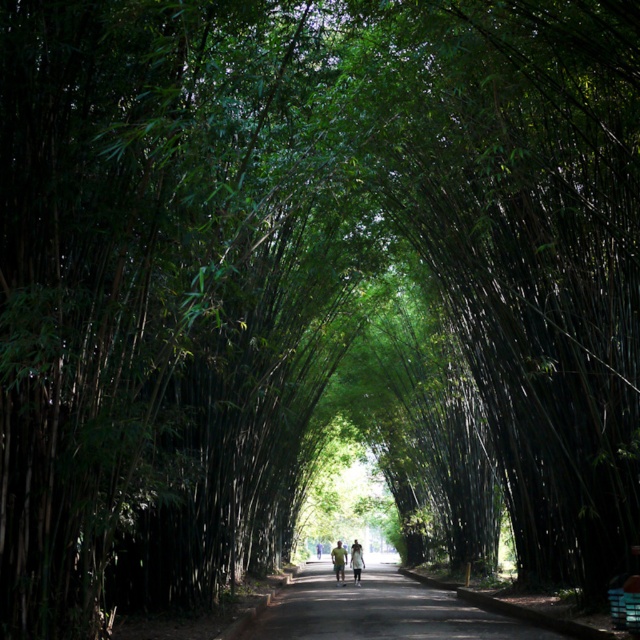
Question: Is light brown leather jacket at center bigger than light green fabric at center?

Choices:
 (A) no
 (B) yes

Answer: (B)

Question: Which of the following is the closest to the observer?

Choices:
 (A) light green fabric at center
 (B) light brown leather jacket at center

Answer: (A)

Question: In this image, where is light brown leather jacket at center located relative to light green fabric at center?

Choices:
 (A) above
 (B) below

Answer: (B)

Question: Which point is farther from the camera taking this photo?

Choices:
 (A) (356, 577)
 (B) (344, 557)

Answer: (B)

Question: Does light brown leather jacket at center appear under light green fabric at center?

Choices:
 (A) yes
 (B) no

Answer: (A)